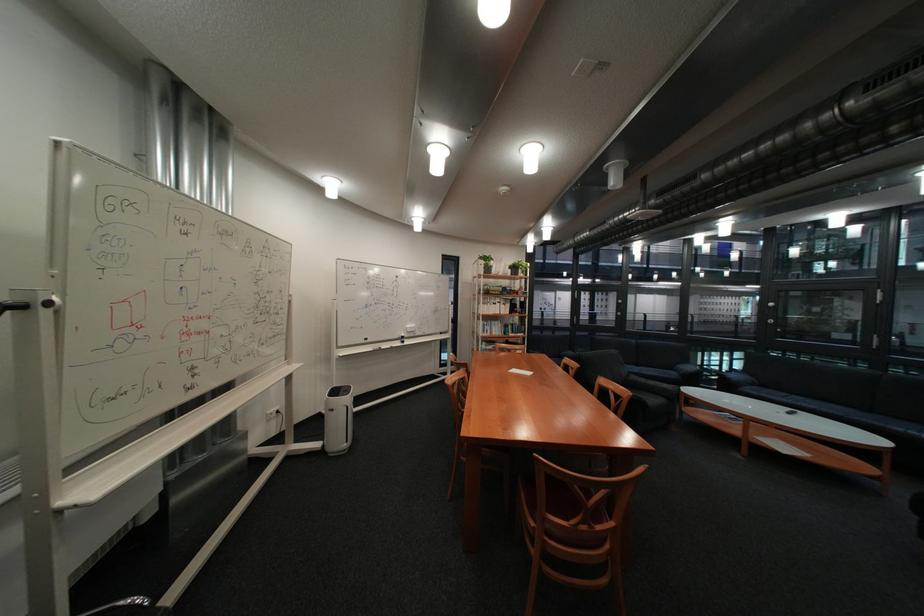
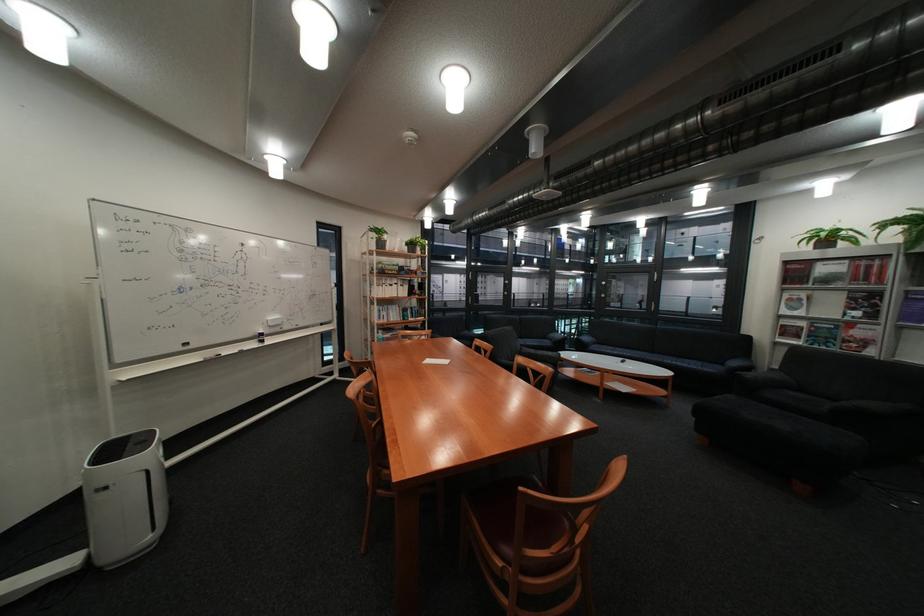
In the second image, find the point that corresponds to (347,410) in the first image.

(120, 488)